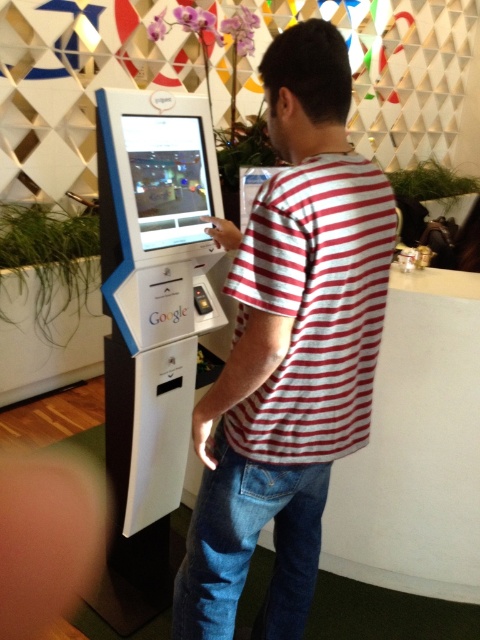
Between point (339, 177) and point (326, 380), which one is positioned behind?

Positioned behind is point (326, 380).

Does white striped shirt at center have a greater height compared to red striped t-shirt at center?

Yes.

At what (x,y) coordinates should I click in order to perform the action: click on white striped shirt at center. Please return your answer as a coordinate pair (x, y). Image resolution: width=480 pixels, height=640 pixels. Looking at the image, I should click on (288, 348).